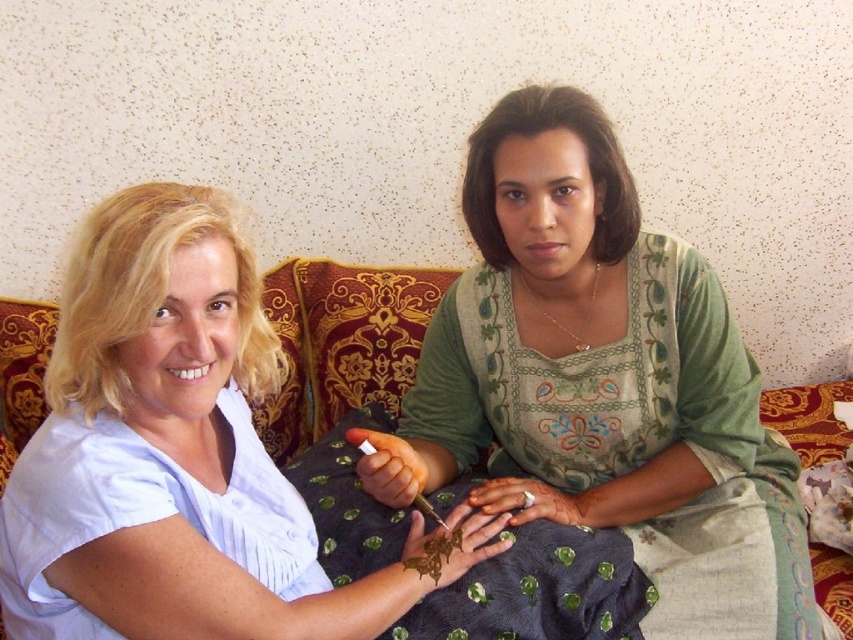
Between point (764, 576) and point (386, 627), which one is positioned behind?

The point (764, 576) is behind.

Between green embroidered dress at center and matte white blouse at left, which one appears on the right side from the viewer's perspective?

green embroidered dress at center

Is point (579, 308) closer to camera compared to point (149, 396)?

No, (579, 308) is further to viewer.

The height and width of the screenshot is (640, 853). In order to click on green embroidered dress at center in this screenshot , I will do `click(602, 381)`.